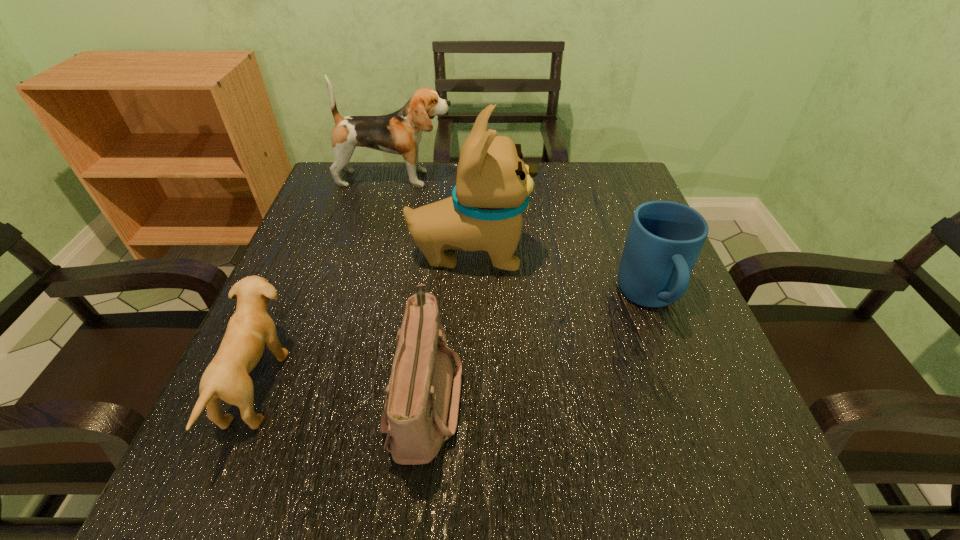
This screenshot has height=540, width=960. I want to click on vacant space located on the front pocket of the shoulder bag, so click(518, 397).

At what (x,y) coordinates should I click in order to perform the action: click on object at the far edge. Please return your answer as a coordinate pair (x, y). Image resolution: width=960 pixels, height=540 pixels. Looking at the image, I should click on (400, 133).

Identify the location of puppy at the near edge. (250, 328).

The image size is (960, 540). I want to click on shoulder bag that is at the near edge, so click(x=421, y=408).

Identify the location of object present at the right edge. The image size is (960, 540). (665, 238).

Locate an element on the screen. This screenshot has width=960, height=540. object located in the far left corner section of the desktop is located at coordinates (400, 133).

Find the location of a particular element. object present at the near left corner is located at coordinates (250, 328).

Find the location of a particular element. This screenshot has width=960, height=540. vacant region at the far edge of the desktop is located at coordinates (447, 189).

You are a GUI agent. You are given a task and a screenshot of the screen. Output one action in this format:
    pyautogui.click(x=<x>, y=<y>)
    Task: Click on the vacant space at the near edge
    
    Given the screenshot: What is the action you would take?
    pyautogui.click(x=576, y=506)

Identify the location of free space at the left edge of the desktop. The image size is (960, 540). (296, 293).